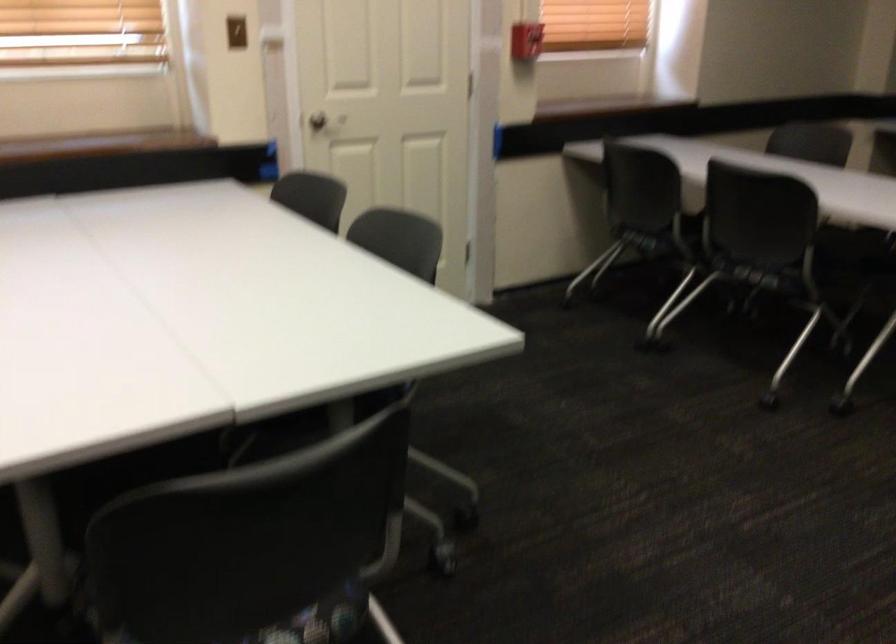
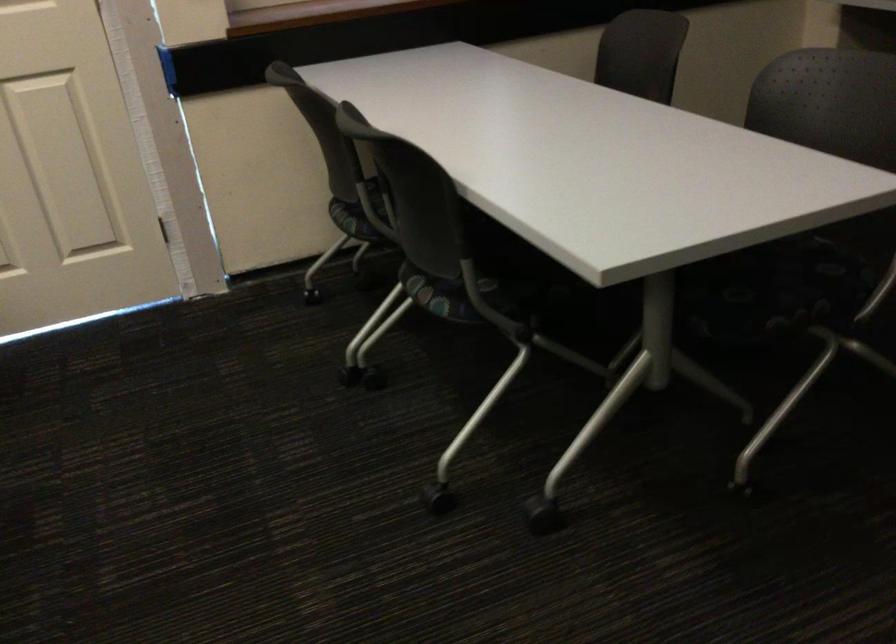
The images are taken continuously from a first-person perspective. In which direction are you moving?

The movement direction of the cameraman is right, forward.